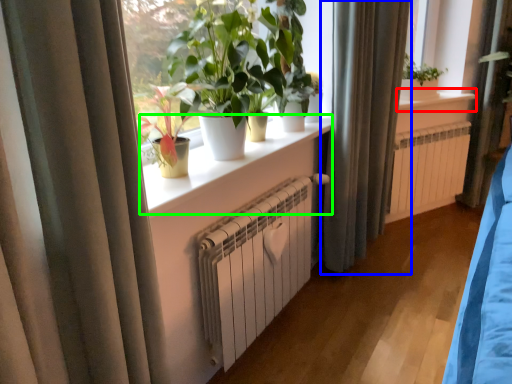
Question: Which is farther away from window sill (highlighted by a red box)? curtain (highlighted by a blue box) or window sill (highlighted by a green box)?

Choices:
 (A) curtain
 (B) window sill

Answer: (B)